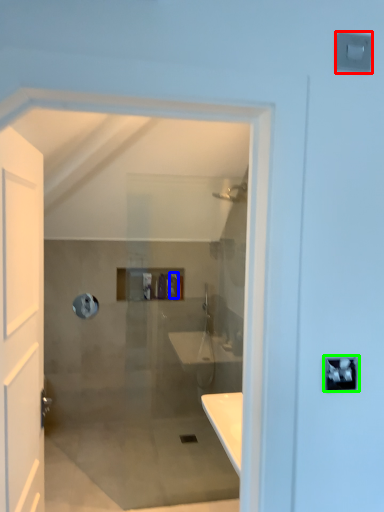
Question: Which object is positioned closest to light switch (highlighted by a red box)? Select from toiletry (highlighted by a blue box) and lock (highlighted by a green box).

Choices:
 (A) toiletry
 (B) lock

Answer: (B)